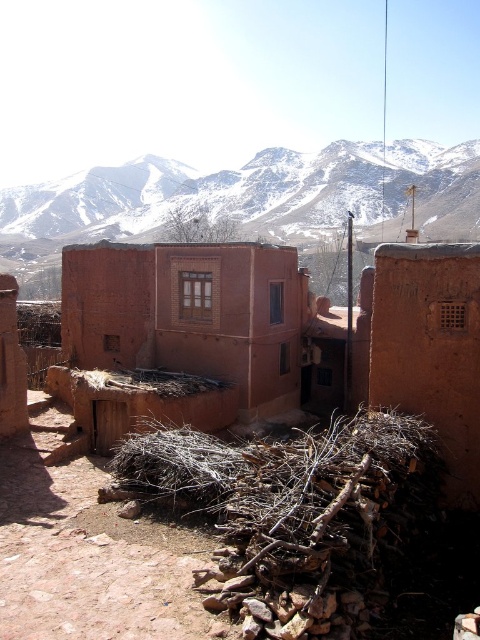
Question: Can you confirm if brown dry wood at lower center is wider than snowy rock at upper center?

Choices:
 (A) yes
 (B) no

Answer: (B)

Question: Which of the following is the farthest from the observer?

Choices:
 (A) (160, 481)
 (B) (450, 157)

Answer: (B)

Question: Which of the following is the closest to the observer?

Choices:
 (A) (324, 484)
 (B) (291, 189)

Answer: (A)

Question: Is the position of brown dry wood at lower center less distant than that of snowy rock at upper center?

Choices:
 (A) yes
 (B) no

Answer: (A)

Question: Can you confirm if brown dry wood at lower center is smaller than snowy rock at upper center?

Choices:
 (A) yes
 (B) no

Answer: (A)